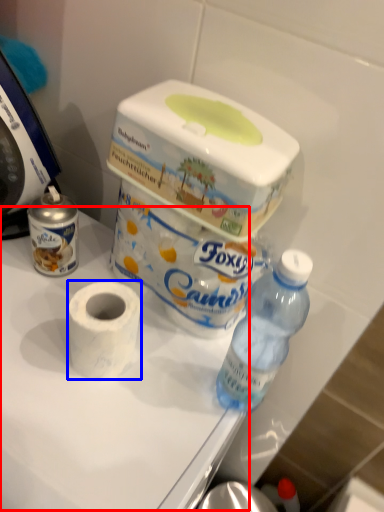
Question: Which point is further to the camera, table (highlighted by a red box) or toilet paper (highlighted by a blue box)?

Choices:
 (A) table
 (B) toilet paper

Answer: (B)